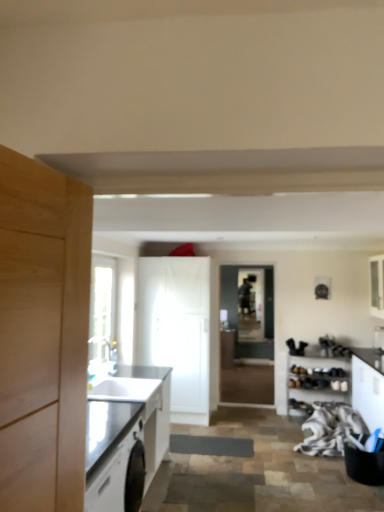
This screenshot has width=384, height=512. What do you see at coordinates (376, 285) in the screenshot? I see `white glossy cabinet at upper right, the 5th cabinetry when ordered from left to right` at bounding box center [376, 285].

The image size is (384, 512). What do you see at coordinates (125, 435) in the screenshot? I see `matte black countertop at left, acting as the 5th cabinetry starting from the right` at bounding box center [125, 435].

You are a GUI agent. You are given a task and a screenshot of the screen. Output one action in this format:
    pyautogui.click(x=<x>, y=<y>)
    Task: Click on the white textured fabric at lower right
    This screenshot has height=512, width=384.
    Given the screenshot: What is the action you would take?
    pyautogui.click(x=330, y=429)

Find the location of a particular element. The width and height of the screenshot is (384, 512). transparent glass door at center is located at coordinates pos(247,341).

Describe the element at coordinates (176, 329) in the screenshot. I see `white glossy cabinet at center, positioned as the fourth cabinetry in right-to-left order` at that location.

Locate an element on the screen. white glossy cabinet at center, positioned as the fourth cabinetry in right-to-left order is located at coordinates click(x=176, y=329).

You are a GUI agent. You are given a task and a screenshot of the screen. Output one action in this format:
    pyautogui.click(x=<x>, y=<y>)
    Task: Click on the white matte shoe rack at lower right, the 3th cabinetry in the right-to-left sequence
    
    Given the screenshot: What is the action you would take?
    pyautogui.click(x=326, y=374)

Is white glossy cabinet at right, placed as the fourth cabinetry when sorted from left to right, smaller than white glossy cabinet at center, positioned as the fourth cabinetry in right-to-left order?

Correct, white glossy cabinet at right, placed as the fourth cabinetry when sorted from left to right, occupies less space than white glossy cabinet at center, positioned as the fourth cabinetry in right-to-left order.

Between white glossy cabinet at right, placed as the fourth cabinetry when sorted from left to right, and white glossy cabinet at center, the second cabinetry in the left-to-right sequence, which one appears on the left side from the viewer's perspective?

white glossy cabinet at center, the second cabinetry in the left-to-right sequence, is more to the left.

Could you tell me if white glossy cabinet at right, the 2th cabinetry when ordered from right to left, is facing white glossy cabinet at center, positioned as the fourth cabinetry in right-to-left order?

Yes, white glossy cabinet at right, the 2th cabinetry when ordered from right to left, is turned towards white glossy cabinet at center, positioned as the fourth cabinetry in right-to-left order.

From the image's perspective, relative to white glossy cabinet at center, positioned as the fourth cabinetry in right-to-left order, is transparent glass door at center above or below?

transparent glass door at center is below white glossy cabinet at center, positioned as the fourth cabinetry in right-to-left order.

Considering the sizes of objects transparent glass door at center and white glossy cabinet at center, positioned as the fourth cabinetry in right-to-left order, in the image provided, who is taller, transparent glass door at center or white glossy cabinet at center, positioned as the fourth cabinetry in right-to-left order,?

white glossy cabinet at center, positioned as the fourth cabinetry in right-to-left order.

Based on the photo, which object is more forward, transparent glass door at center or white glossy cabinet at center, the second cabinetry in the left-to-right sequence?

white glossy cabinet at center, the second cabinetry in the left-to-right sequence.

Is point (268, 295) less distant than point (374, 282)?

No, (268, 295) is behind (374, 282).

Is the depth of transparent glass door at center less than that of white glossy cabinet at upper right, the 5th cabinetry when ordered from left to right?

No, it is not.

Consider the image. How distant is transparent glass door at center from white glossy cabinet at upper right, the 5th cabinetry when ordered from left to right?

The distance of transparent glass door at center from white glossy cabinet at upper right, the 5th cabinetry when ordered from left to right, is 1.66 meters.

From the image's perspective, between transparent glass door at center and white glossy cabinet at upper right, the 1th cabinetry viewed from the right, which one is located above?

white glossy cabinet at upper right, the 1th cabinetry viewed from the right, appears higher in the image.

Looking at their sizes, would you say matte black countertop at left, acting as the 5th cabinetry starting from the right, is wider or thinner than transparent glass window screen at center?

matte black countertop at left, acting as the 5th cabinetry starting from the right, is wider than transparent glass window screen at center.

Is matte black countertop at left, acting as the 5th cabinetry starting from the right, at the right side of transparent glass window screen at center?

No, matte black countertop at left, acting as the 5th cabinetry starting from the right, is not to the right of transparent glass window screen at center.

From a real-world perspective, does matte black countertop at left, positioned as the 1th cabinetry in left-to-right order, sit lower than transparent glass window screen at center?

Yes.

Looking at this image, which point is more distant from viewer, (x=371, y=276) or (x=334, y=442)?

Positioned behind is point (x=371, y=276).

Which of these two, white glossy cabinet at upper right, the 5th cabinetry when ordered from left to right, or white textured fabric at lower right, stands taller?

Standing taller between the two is white glossy cabinet at upper right, the 5th cabinetry when ordered from left to right.

Can you confirm if white glossy cabinet at upper right, the 1th cabinetry viewed from the right, is bigger than white textured fabric at lower right?

Incorrect, white glossy cabinet at upper right, the 1th cabinetry viewed from the right, is not larger than white textured fabric at lower right.

From a real-world perspective, which object rests below the other?

white textured fabric at lower right is physically lower.

Is matte black countertop at left, acting as the 5th cabinetry starting from the right, to the right of white glossy cabinet at right, placed as the fourth cabinetry when sorted from left to right, from the viewer's perspective?

Incorrect, matte black countertop at left, acting as the 5th cabinetry starting from the right, is not on the right side of white glossy cabinet at right, placed as the fourth cabinetry when sorted from left to right.

Is matte black countertop at left, acting as the 5th cabinetry starting from the right, thinner than white glossy cabinet at right, placed as the fourth cabinetry when sorted from left to right?

Incorrect, the width of matte black countertop at left, acting as the 5th cabinetry starting from the right, is not less than that of white glossy cabinet at right, placed as the fourth cabinetry when sorted from left to right.

Image resolution: width=384 pixels, height=512 pixels. Identify the location of the 1st cabinetry located above the white glossy cabinet at right, placed as the fourth cabinetry when sorted from left to right (from a real-world perspective). (125, 435).

Can you tell me how much matte black countertop at left, acting as the 5th cabinetry starting from the right, and white glossy cabinet at right, the 2th cabinetry when ordered from right to left, differ in facing direction?

matte black countertop at left, acting as the 5th cabinetry starting from the right, and white glossy cabinet at right, the 2th cabinetry when ordered from right to left, are facing 179 degrees away from each other.

Does white glossy cabinet at center, the second cabinetry in the left-to-right sequence, come behind clear glass window at upper left?

Yes, it is behind clear glass window at upper left.

From the picture: From the image's perspective, which is below, white glossy cabinet at center, positioned as the fourth cabinetry in right-to-left order, or clear glass window at upper left?

white glossy cabinet at center, positioned as the fourth cabinetry in right-to-left order.

Can you confirm if white glossy cabinet at center, positioned as the fourth cabinetry in right-to-left order, is thinner than clear glass window at upper left?

Incorrect, the width of white glossy cabinet at center, positioned as the fourth cabinetry in right-to-left order, is not less than that of clear glass window at upper left.

Is white glossy cabinet at center, the second cabinetry in the left-to-right sequence, in contact with clear glass window at upper left?

white glossy cabinet at center, the second cabinetry in the left-to-right sequence, and clear glass window at upper left are clearly separated.

This screenshot has height=512, width=384. I want to click on cabinetry that is the 2nd one when counting forward from the white glossy cabinet at center, the second cabinetry in the left-to-right sequence, so [368, 393].

In the image, there is a white glossy cabinet at center, the second cabinetry in the left-to-right sequence. Identify the location of glass door below it (from a real-world perspective). (247, 341).

When comparing their distances from white glossy cabinet at right, placed as the fourth cabinetry when sorted from left to right, does clear glass window at upper left or matte black countertop at left, positioned as the 1th cabinetry in left-to-right order, seem further?

clear glass window at upper left.

Considering their positions, is white matte shoe rack at lower right, the 3th cabinetry in the right-to-left sequence, positioned further to transparent glass door at center than clear glass window at upper left?

clear glass window at upper left.

Based on their spatial positions, is white matte shoe rack at lower right, the 3th cabinetry in the right-to-left sequence, or transparent glass window screen at center closer to white glossy cabinet at center, the second cabinetry in the left-to-right sequence?

Among the two, transparent glass window screen at center is located nearer to white glossy cabinet at center, the second cabinetry in the left-to-right sequence.

From the image, which object appears to be nearer to clear glass window at upper left, transparent glass window screen at center or white textured fabric at lower right?

The object closer to clear glass window at upper left is transparent glass window screen at center.

Based on the photo, considering their positions, is white glossy cabinet at center, positioned as the fourth cabinetry in right-to-left order, positioned closer to white textured fabric at lower right than clear glass window at upper left?

white glossy cabinet at center, positioned as the fourth cabinetry in right-to-left order, is closer to white textured fabric at lower right.

Considering their positions, is transparent glass window screen at center positioned further to matte black countertop at left, positioned as the 1th cabinetry in left-to-right order, than white glossy cabinet at center, positioned as the fourth cabinetry in right-to-left order?

Based on the image, transparent glass window screen at center appears to be further to matte black countertop at left, positioned as the 1th cabinetry in left-to-right order.

From the image, which object appears to be nearer to clear glass window at upper left, transparent glass window screen at center or matte black countertop at left, acting as the 5th cabinetry starting from the right?

matte black countertop at left, acting as the 5th cabinetry starting from the right.

Looking at the image, which one is located closer to white textured fabric at lower right, white glossy cabinet at upper right, the 5th cabinetry when ordered from left to right, or transparent glass door at center?

transparent glass door at center is closer to white textured fabric at lower right.

At what (x,y) coordinates should I click in order to perform the action: click on glass door situated between clear glass window at upper left and white glossy cabinet at upper right, the 5th cabinetry when ordered from left to right, from left to right. Please return your answer as a coordinate pair (x, y). The height and width of the screenshot is (512, 384). Looking at the image, I should click on (247, 341).

This screenshot has width=384, height=512. I want to click on material between white glossy cabinet at right, placed as the fourth cabinetry when sorted from left to right, and white matte shoe rack at lower right, which appears as the 3th cabinetry when viewed from the left, in the front-back direction, so click(x=330, y=429).

Image resolution: width=384 pixels, height=512 pixels. I want to click on glass door between white glossy cabinet at center, positioned as the fourth cabinetry in right-to-left order, and white matte shoe rack at lower right, the 3th cabinetry in the right-to-left sequence, from left to right, so click(x=247, y=341).

At what (x,y) coordinates should I click in order to perform the action: click on glass door between matte black countertop at left, acting as the 5th cabinetry starting from the right, and transparent glass window screen at center, along the z-axis. Please return your answer as a coordinate pair (x, y). Image resolution: width=384 pixels, height=512 pixels. Looking at the image, I should click on (247, 341).